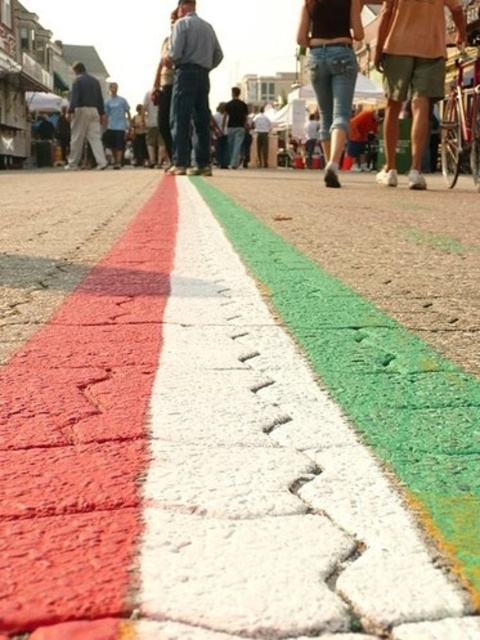
Can you confirm if light blue shirt at center is positioned to the left of dark blue jeans at center?

Yes, light blue shirt at center is to the left of dark blue jeans at center.

Between point (104, 118) and point (240, 131), which one is positioned behind?

The point (240, 131) is more distant.

At what (x,y) coordinates should I click in order to perform the action: click on light blue shirt at center. Please return your answer as a coordinate pair (x, y). This screenshot has width=480, height=640. Looking at the image, I should click on (116, 124).

Is matte gray pants at left above dark blue jeans at center?

Incorrect, matte gray pants at left is not positioned above dark blue jeans at center.

Can you confirm if matte gray pants at left is positioned to the right of dark blue jeans at center?

Incorrect, matte gray pants at left is not on the right side of dark blue jeans at center.

This screenshot has width=480, height=640. Describe the element at coordinates (84, 116) in the screenshot. I see `matte gray pants at left` at that location.

Locate an element on the screen. This screenshot has height=640, width=480. matte gray pants at left is located at coordinates tap(84, 116).

Between cracked asphalt pavement at center and matte khaki shorts at center, which one appears on the right side from the viewer's perspective?

matte khaki shorts at center is more to the right.

Between cracked asphalt pavement at center and matte khaki shorts at center, which one appears on the left side from the viewer's perspective?

cracked asphalt pavement at center is more to the left.

Which is behind, point (170, 356) or point (396, 12)?

Point (396, 12)

Find the location of a particular element. cracked asphalt pavement at center is located at coordinates (194, 467).